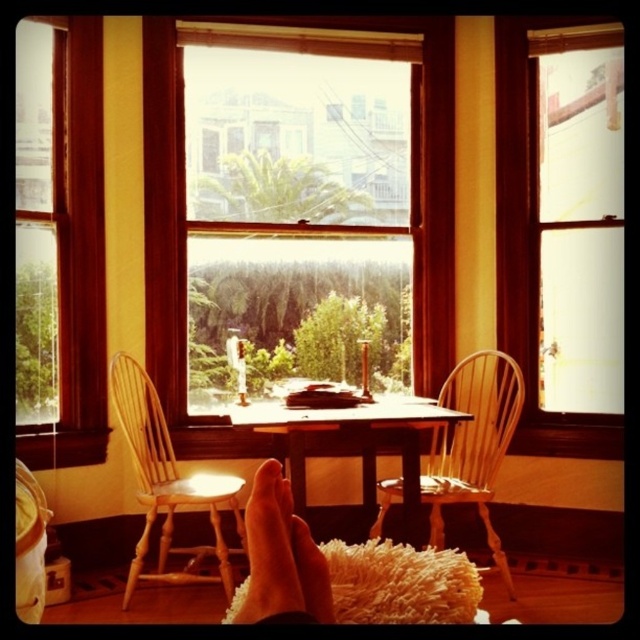
Question: Which point is farther from the camera taking this photo?

Choices:
 (A) pyautogui.click(x=81, y=128)
 (B) pyautogui.click(x=602, y=438)
 (C) pyautogui.click(x=307, y=602)

Answer: (B)

Question: Which object appears farthest from the camera in this image?

Choices:
 (A) wooden frame window at center
 (B) light brown wood chair at center
 (C) skinny flesh-toned foot at lower center
 (D) clear glass window at center

Answer: (D)

Question: Is clear glass window at center smaller than wooden frame window at center?

Choices:
 (A) yes
 (B) no

Answer: (B)

Question: Among these points, which one is farthest from the camera?

Choices:
 (A) (497, 344)
 (B) (157, 422)
 (C) (493, 380)
 (D) (67, 324)

Answer: (A)

Question: Can you confirm if light brown wood chair at center is smaller than wooden table at center?

Choices:
 (A) yes
 (B) no

Answer: (A)

Question: Does light brown wooden chair at center lie behind skinny flesh-toned foot at lower center?

Choices:
 (A) no
 (B) yes

Answer: (B)